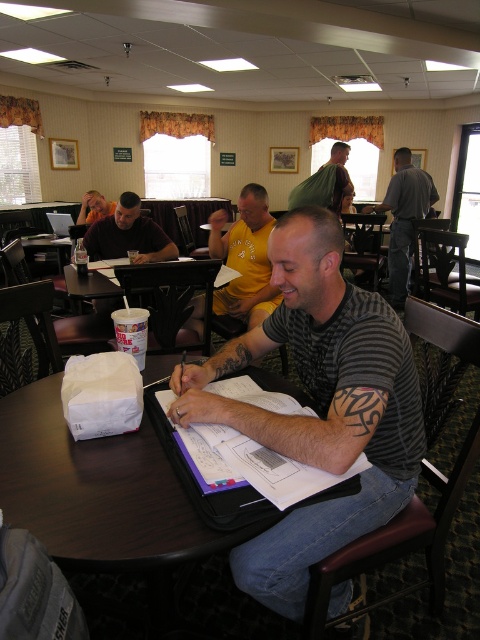
Question: Based on their relative distances, which object is farther from the green fabric shirt at upper center?

Choices:
 (A) yellow t-shirt at center
 (B) matte black laptop at upper left
 (C) white paper cup at center
 (D) matte black shirt at center

Answer: (B)

Question: Does gray striped shirt at center appear over matte black laptop at upper left?

Choices:
 (A) no
 (B) yes

Answer: (A)

Question: Considering the real-world distances, which object is closest to the green fabric shirt at upper center?

Choices:
 (A) gray striped shirt at center
 (B) white paper cup at center

Answer: (B)

Question: Which point is farther to the camera?

Choices:
 (A) (148, 275)
 (B) (309, 259)
 (C) (325, 204)
 (D) (148, 234)

Answer: (C)

Question: Does white paper cup at center have a smaller size compared to green fabric shirt at upper center?

Choices:
 (A) yes
 (B) no

Answer: (A)

Question: Does gray striped shirt at center have a lesser width compared to matte black shirt at center?

Choices:
 (A) yes
 (B) no

Answer: (B)